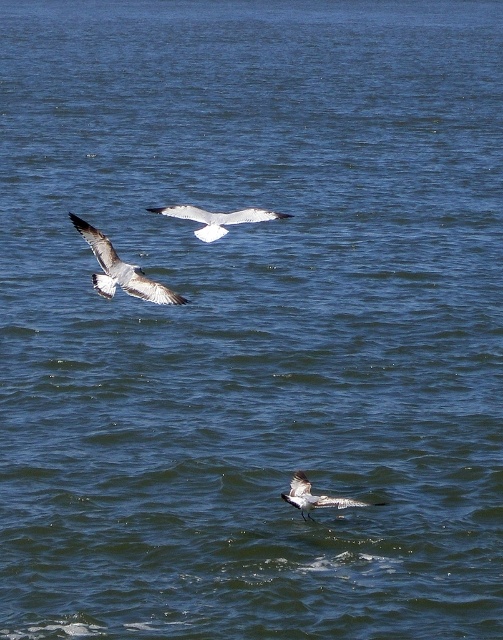
Is point (103, 284) closer to viewer compared to point (195, 230)?

Yes, it is in front of point (195, 230).

Is point (100, 292) positioned in front of point (275, 216)?

Yes, it is.

Locate an element on the screen. This screenshot has height=640, width=503. speckled feathered seagull at upper left is located at coordinates (121, 269).

Looking at this image, who is taller, speckled feathered seagull at upper left or speckled feathered bird at lower center?

speckled feathered seagull at upper left is taller.

Is point (118, 268) behind point (301, 484)?

Yes, point (118, 268) is farther from viewer.

This screenshot has height=640, width=503. In order to click on speckled feathered seagull at upper left in this screenshot , I will do `click(121, 269)`.

Between white matte bird at center and speckled feathered bird at lower center, which one has less height?

speckled feathered bird at lower center

At what (x,y) coordinates should I click in order to perform the action: click on white matte bird at center. Please return your answer as a coordinate pair (x, y). Looking at the image, I should click on (216, 218).

The image size is (503, 640). In order to click on white matte bird at center in this screenshot , I will do `click(216, 218)`.